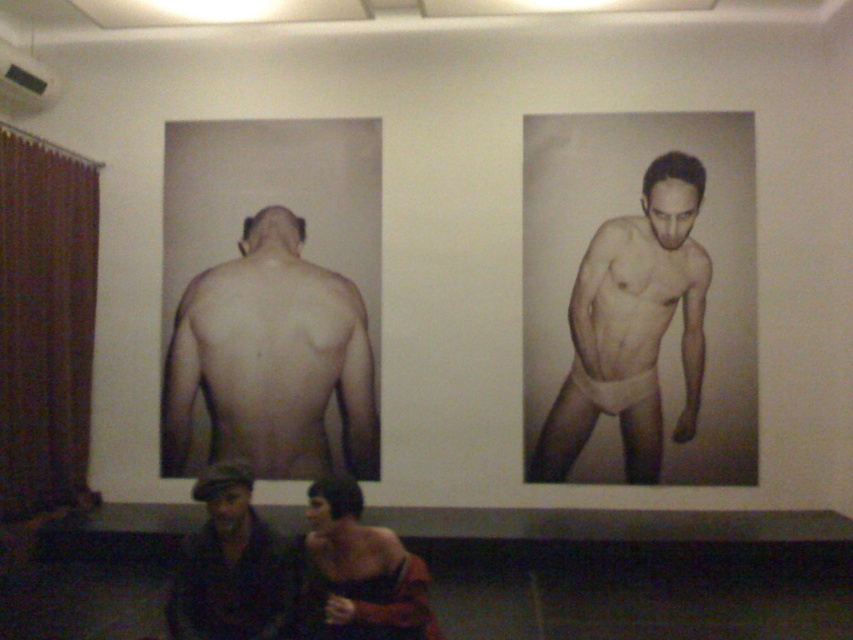
Question: Does matte beige underwear at right have a greater width compared to smooth skin man at lower center?

Choices:
 (A) yes
 (B) no

Answer: (A)

Question: Which of these objects is positioned closest to the smooth skin man at lower center?

Choices:
 (A) dark brown leather jacket at lower left
 (B) smooth skin back at center

Answer: (A)

Question: Among these objects, which one is farthest from the camera?

Choices:
 (A) smooth skin back at center
 (B) dark brown leather jacket at lower left

Answer: (A)

Question: Can you confirm if matte beige underwear at right is bigger than dark brown leather jacket at lower left?

Choices:
 (A) yes
 (B) no

Answer: (A)

Question: Considering the relative positions of smooth skin back at center and dark brown leather jacket at lower left in the image provided, where is smooth skin back at center located with respect to dark brown leather jacket at lower left?

Choices:
 (A) right
 (B) left

Answer: (B)

Question: Which point appears farthest from the camera in this image?

Choices:
 (A) (692, 257)
 (B) (247, 596)
 (C) (396, 536)

Answer: (A)